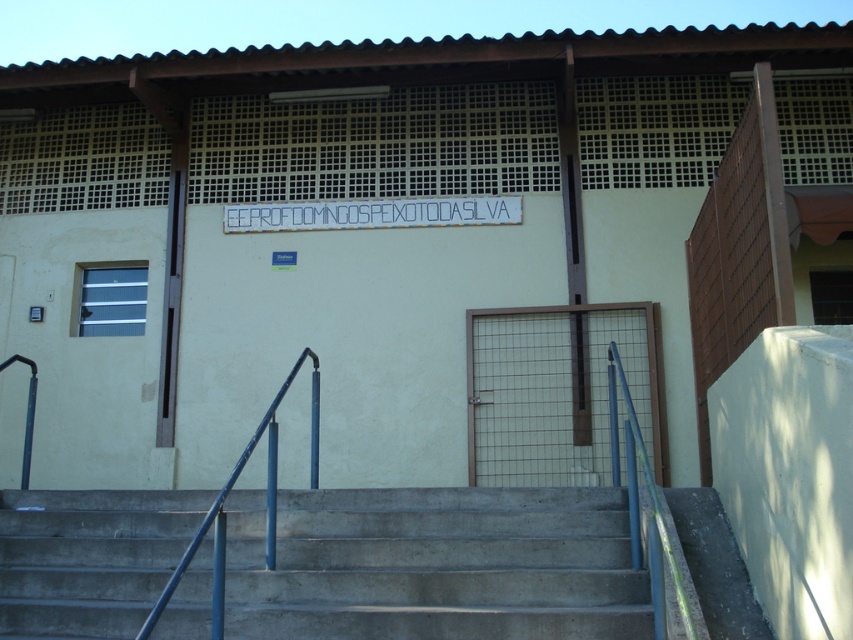
Question: Which of the following is the closest to the observer?

Choices:
 (A) (94, 624)
 (B) (318, 218)

Answer: (A)

Question: Which point appears farthest from the camera in this image?

Choices:
 (A) (448, 592)
 (B) (386, 220)
 (C) (152, 627)

Answer: (B)

Question: Is concrete/steps at center below white plastic sign at center?

Choices:
 (A) no
 (B) yes

Answer: (B)

Question: Is concrete/steps at center bigger than white plastic sign at center?

Choices:
 (A) yes
 (B) no

Answer: (A)

Question: Considering the relative positions of white plastic sign at center and blue metallic handrail at center in the image provided, where is white plastic sign at center located with respect to blue metallic handrail at center?

Choices:
 (A) above
 (B) below

Answer: (A)

Question: Which object is the closest to the concrete/steps at center?

Choices:
 (A) white plastic sign at center
 (B) blue metallic handrail at center

Answer: (B)